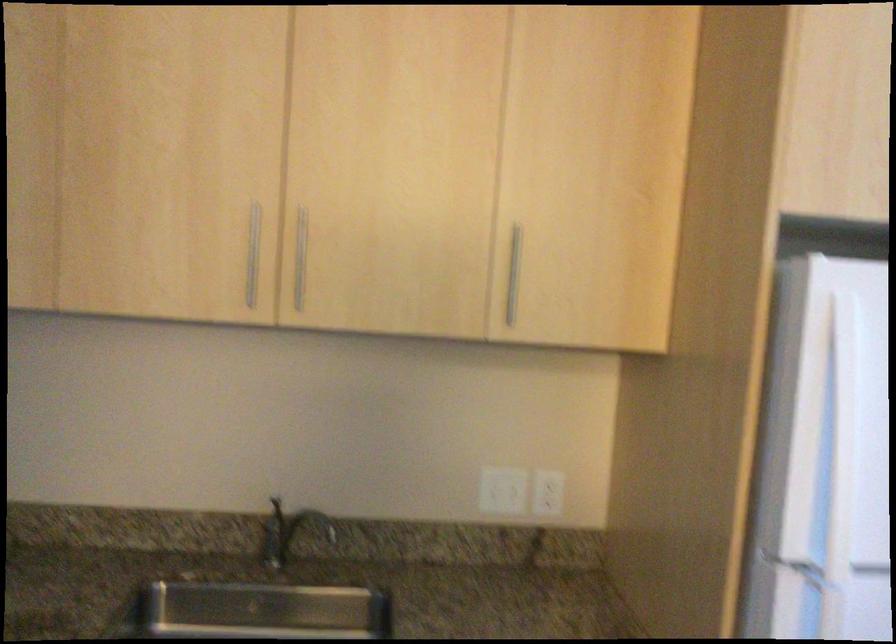
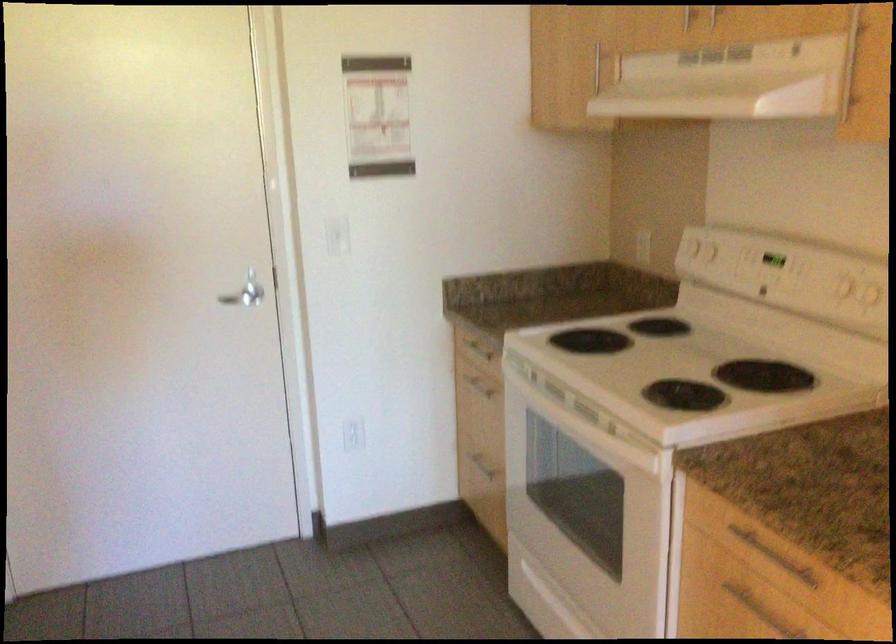
Question: The camera is either moving clockwise (left) or counter-clockwise (right) around the object. The first image is from the beginning of the video and the second image is from the end. Is the camera moving left or right when shooting the video?

Choices:
 (A) Left
 (B) Right

Answer: (B)